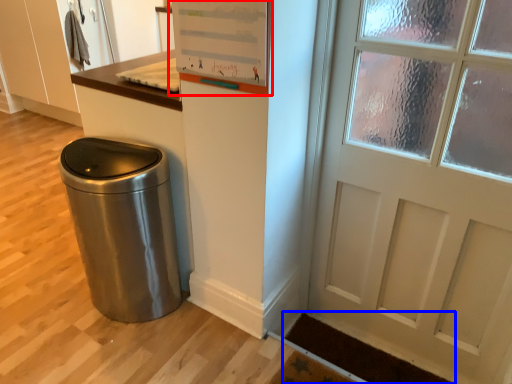
Question: Among these objects, which one is farthest to the camera, bulletin board (highlighted by a red box) or doormat (highlighted by a blue box)?

Choices:
 (A) bulletin board
 (B) doormat

Answer: (B)